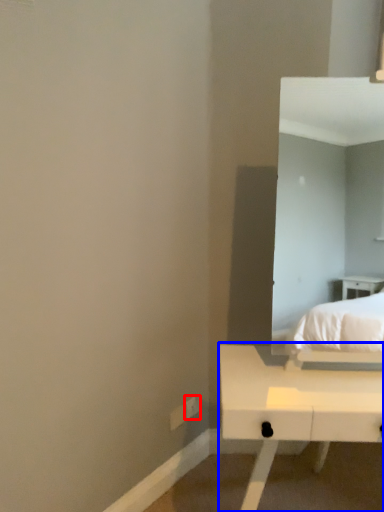
Question: Which point is closer to the camera, electric outlet (highlighted by a red box) or table (highlighted by a blue box)?

Choices:
 (A) electric outlet
 (B) table

Answer: (B)